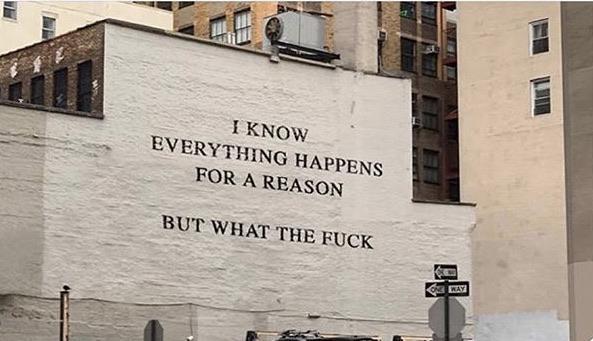
Find the location of a particular element. The image size is (593, 341). white wall is located at coordinates (535, 335), (164, 187), (72, 14).